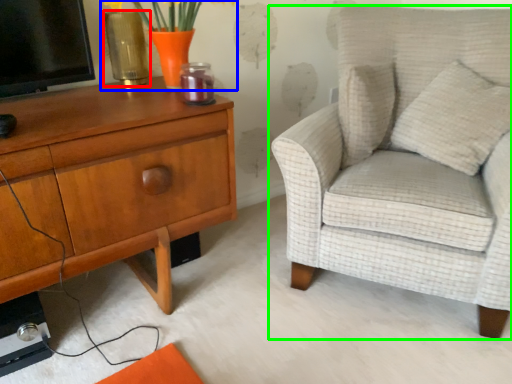
Question: Which object is positioned farthest from vase (highlighted by a red box)? Select from floral arrangement (highlighted by a blue box) and chair (highlighted by a green box).

Choices:
 (A) floral arrangement
 (B) chair

Answer: (B)